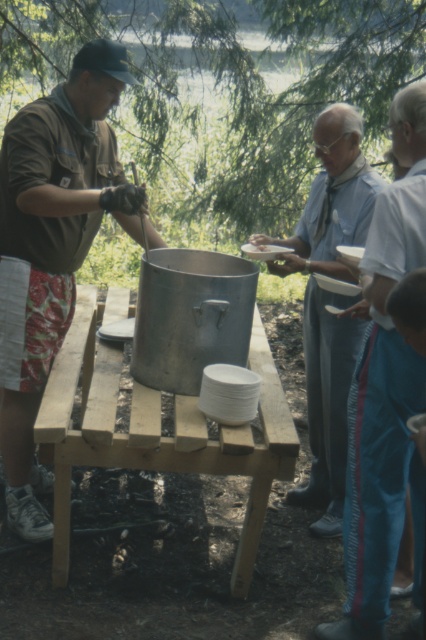
You are a person with a 1.2 meter wide backpack. You want to walk between the wooden table at center and the blue cotton shirt at center. Is there enough space for you to pass through?

The wooden table at center might be wider than blue cotton shirt at center, so there might not be enough space for the backpack to pass through safely. It is recommended to check the exact width difference before attempting to move through.

You are a photographer standing at the edge of the scene. You want to take a photo that includes both the blue track pants at right and the wooden table at center. Which object should you position closer to the camera to ensure both are fully visible in the frame?

The blue track pants at right is much taller than the wooden table at center, so positioning the blue track pants at right closer to the camera will help ensure both are fully visible in the frame.

Consider the image. You are organizing a picnic and need to decide where to place a new basket. The blue track pants at right and the wooden table at center are both in your view. Which object is smaller and should the basket be placed on it?

The blue track pants at right has a smaller size compared to wooden table at center, so the basket should be placed on the wooden table at center because it is larger and more stable.